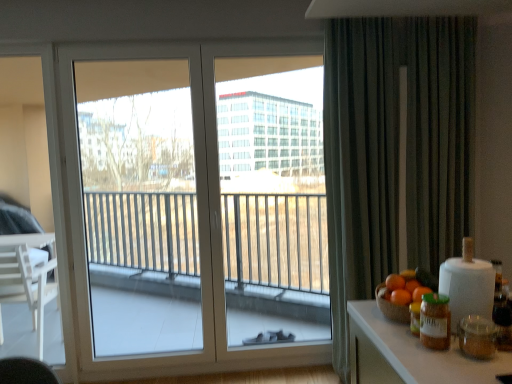
Question: From a real-world perspective, is orange matte at right, acting as the second orange starting from the back, located beneath white glass window at center?

Choices:
 (A) yes
 (B) no

Answer: (A)

Question: Does orange matte at right, the 2th orange in the front-to-back sequence, have a greater height compared to white glass window at center?

Choices:
 (A) yes
 (B) no

Answer: (B)

Question: Could you tell me if orange matte at right, the 2th orange in the front-to-back sequence, is turned towards white glass window at center?

Choices:
 (A) no
 (B) yes

Answer: (A)

Question: Is white glass window at center a part of orange matte at right, acting as the second orange starting from the back?

Choices:
 (A) no
 (B) yes

Answer: (A)

Question: Does orange matte at right, the 2th orange in the front-to-back sequence, come in front of white glass window at center?

Choices:
 (A) no
 (B) yes

Answer: (B)

Question: Would you say orange matte at right, which is the 1th orange in front-to-back order, is inside or outside orange matte at right, acting as the second orange starting from the back?

Choices:
 (A) outside
 (B) inside

Answer: (A)

Question: Considering the positions of point (403, 304) and point (406, 294), is point (403, 304) closer or farther from the camera than point (406, 294)?

Choices:
 (A) farther
 (B) closer

Answer: (B)

Question: Would you say orange matte at right, marked as the third orange in a back-to-front arrangement, is to the left or to the right of orange matte at right, the 2th orange in the front-to-back sequence, in the picture?

Choices:
 (A) left
 (B) right

Answer: (A)

Question: From a real-world perspective, is orange matte at right, marked as the third orange in a back-to-front arrangement, above or below orange matte at right, the 2th orange in the front-to-back sequence?

Choices:
 (A) below
 (B) above

Answer: (A)

Question: From a real-world perspective, is orange matte at right, the 2th orange in the front-to-back sequence, positioned above or below orange matte at right, which is the 1th orange in front-to-back order?

Choices:
 (A) above
 (B) below

Answer: (A)

Question: Relative to orange matte at right, marked as the third orange in a back-to-front arrangement, is orange matte at right, acting as the second orange starting from the back, in front or behind?

Choices:
 (A) behind
 (B) front

Answer: (A)

Question: In terms of size, does orange matte at right, acting as the second orange starting from the back, appear bigger or smaller than orange matte at right, which is the 1th orange in front-to-back order?

Choices:
 (A) small
 (B) big

Answer: (B)

Question: Is orange matte at right, acting as the second orange starting from the back, inside or outside of orange matte at right, which is the 1th orange in front-to-back order?

Choices:
 (A) inside
 (B) outside

Answer: (B)

Question: Does point (434, 322) appear closer or farther from the camera than point (393, 289)?

Choices:
 (A) farther
 (B) closer

Answer: (B)

Question: In the image, is green matte jar at right on the left side or the right side of orange matte at right, acting as the second orange starting from the back?

Choices:
 (A) right
 (B) left

Answer: (B)